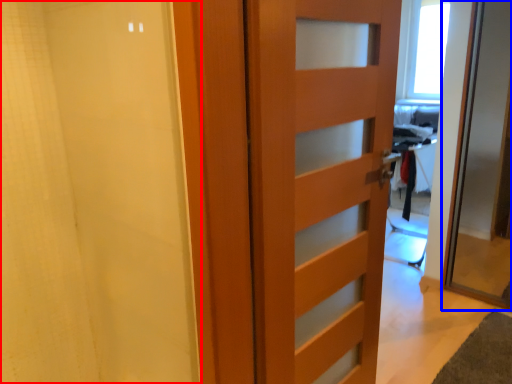
Question: Which object is further to the camera taking this photo, shower curtain (highlighted by a red box) or door (highlighted by a blue box)?

Choices:
 (A) shower curtain
 (B) door

Answer: (B)